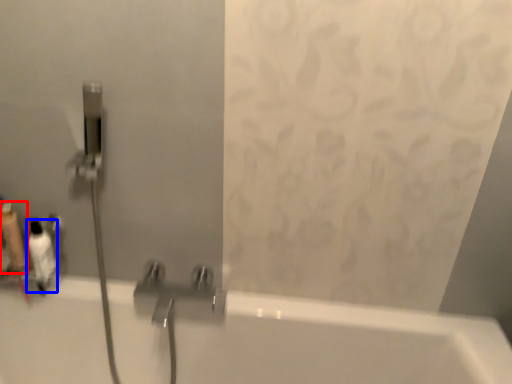
Question: Which object is closer to the camera taking this photo, toiletry (highlighted by a red box) or toiletry (highlighted by a blue box)?

Choices:
 (A) toiletry
 (B) toiletry

Answer: (B)